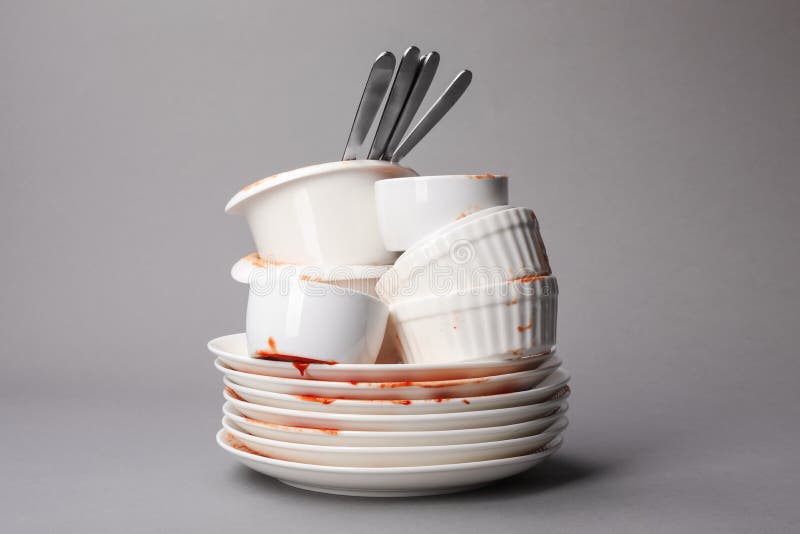
Locate an element on the screen. bowls is located at coordinates (329, 329), (466, 324), (474, 268), (448, 199), (450, 224), (340, 216), (350, 274).